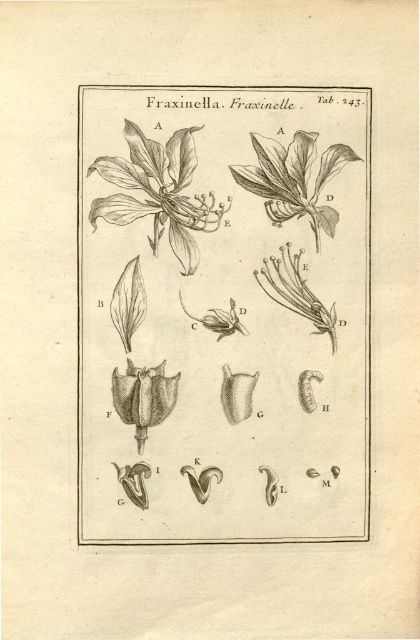
Based on the botanical illustration described, where is the black ink drawing of flower at upper center located in terms of coordinates?

The black ink drawing of flower at upper center is located at coordinates point (223, 314).

Based on the botanical illustration described, where is the brown textured flower at upper left located in terms of coordinates?

The brown textured flower at upper left is located at coordinates point (157,192).